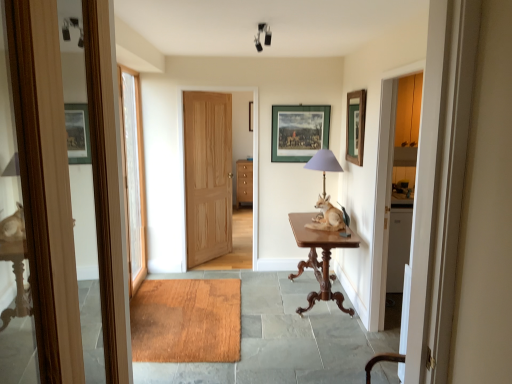
Question: Could you tell me if matte purple glass table lamp at center is facing green matte picture frame at upper right, which ranks as the 1th picture frame in front-to-back order?

Choices:
 (A) yes
 (B) no

Answer: (B)

Question: Is matte purple glass table lamp at center with green matte picture frame at upper right, which ranks as the 1th picture frame in front-to-back order?

Choices:
 (A) yes
 (B) no

Answer: (B)

Question: Can you confirm if matte purple glass table lamp at center is bigger than green matte picture frame at upper right, which ranks as the 1th picture frame in front-to-back order?

Choices:
 (A) no
 (B) yes

Answer: (B)

Question: Would you say green matte picture frame at upper right, positioned as the second picture frame in back-to-front order, is part of matte purple glass table lamp at center's contents?

Choices:
 (A) no
 (B) yes

Answer: (A)

Question: Is matte purple glass table lamp at center positioned far away from green matte picture frame at upper right, positioned as the second picture frame in back-to-front order?

Choices:
 (A) no
 (B) yes

Answer: (A)

Question: Considering the relative sizes of matte purple glass table lamp at center and green matte picture frame at upper right, the 2th picture frame when ordered from left to right, in the image provided, is matte purple glass table lamp at center shorter than green matte picture frame at upper right, the 2th picture frame when ordered from left to right,?

Choices:
 (A) no
 (B) yes

Answer: (B)

Question: From the image's perspective, does wooden mat at center appear lower than white glass door at left, positioned as the second door in back-to-front order?

Choices:
 (A) yes
 (B) no

Answer: (A)

Question: Is the depth of wooden mat at center greater than that of white glass door at left, the 2th door positioned from the right?

Choices:
 (A) yes
 (B) no

Answer: (B)

Question: Is wooden mat at center bigger than white glass door at left, placed as the first door when sorted from front to back?

Choices:
 (A) no
 (B) yes

Answer: (B)

Question: Would you say wooden mat at center contains white glass door at left, positioned as the second door in back-to-front order?

Choices:
 (A) yes
 (B) no

Answer: (B)

Question: Is wooden mat at center taller than white glass door at left, positioned as the second door in back-to-front order?

Choices:
 (A) yes
 (B) no

Answer: (B)

Question: Would you say wooden mat at center is a long distance from white glass door at left, placed as the first door when sorted from front to back?

Choices:
 (A) no
 (B) yes

Answer: (B)

Question: Is the surface of mahogany wood table at center in direct contact with matte purple glass table lamp at center?

Choices:
 (A) no
 (B) yes

Answer: (A)